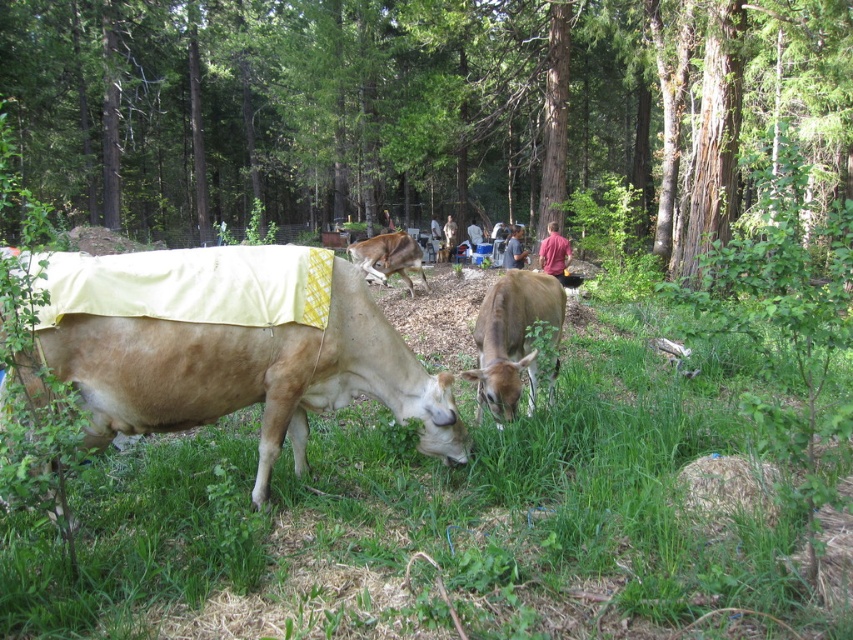
Is green leafy tree at center wider than green grassy at center?

Yes.

Between green leafy tree at center and green grassy at center, which one has more height?

Standing taller between the two is green leafy tree at center.

Where is `green leafy tree at center`? green leafy tree at center is located at coordinates (422, 113).

Between point (519, 198) and point (136, 288), which one is positioned behind?

Point (519, 198)

Is point (434, 17) less distant than point (268, 483)?

That is False.

Identify the location of green leafy tree at center. (422, 113).

Is green leafy tree at center wider than brown matte cow at center?

Yes.

Is green leafy tree at center closer to camera compared to brown matte cow at center?

Yes.

Is point (173, 193) closer to camera compared to point (497, 323)?

That is False.

Locate an element on the screen. green leafy tree at center is located at coordinates (422, 113).